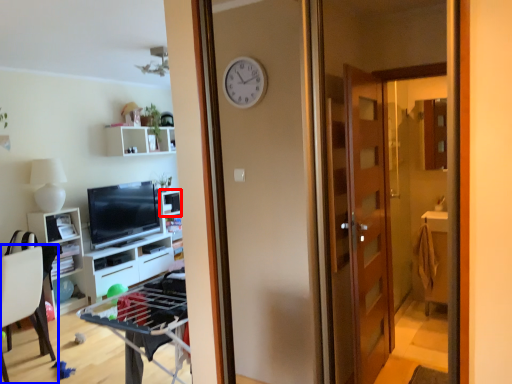
Question: Among these objects, which one is farthest to the camera, shelf (highlighted by a red box) or chair (highlighted by a blue box)?

Choices:
 (A) shelf
 (B) chair

Answer: (A)